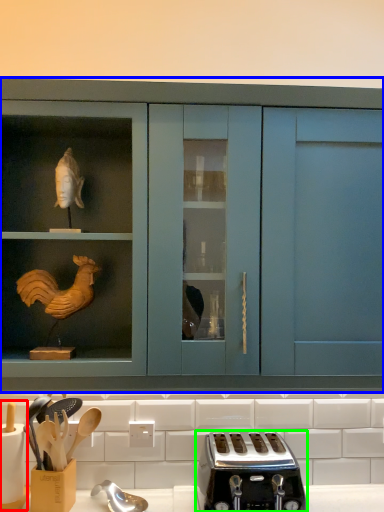
Question: Which object is the closest to the appliance (highlighted by a red box)? Choose among these: cabinetry (highlighted by a blue box) or toaster (highlighted by a green box).

Choices:
 (A) cabinetry
 (B) toaster

Answer: (B)